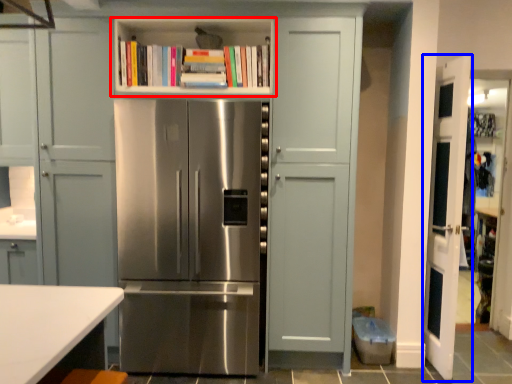
Question: Which object appears closest to the camera in this image, shelf (highlighted by a red box) or door (highlighted by a blue box)?

Choices:
 (A) shelf
 (B) door

Answer: (B)